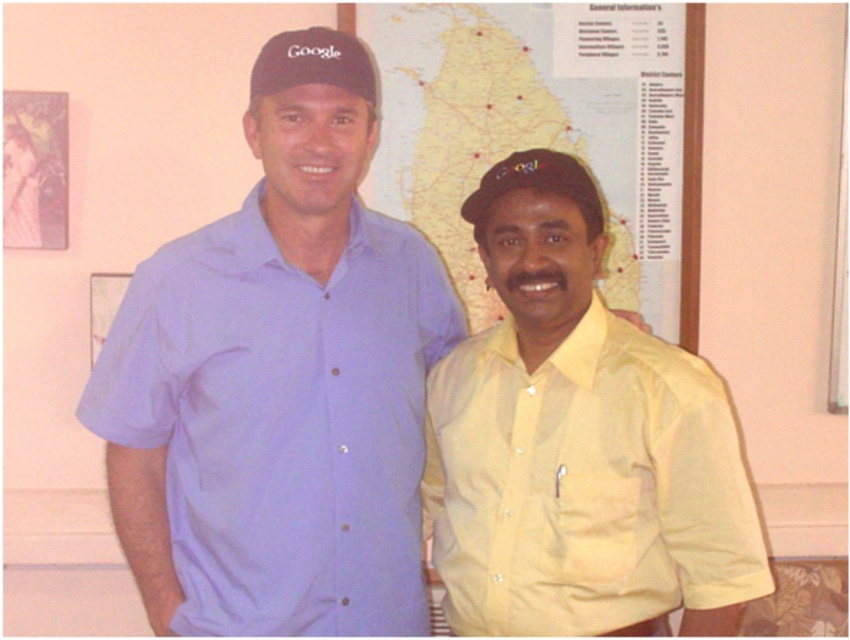
The image size is (850, 640). What are the coordinates of `yellow satin shirt at right` in the screenshot? It's located at (584, 484).

Is point (700, 538) positioned in front of point (313, 54)?

That is True.

The image size is (850, 640). In order to click on yellow satin shirt at right in this screenshot , I will do `click(584, 484)`.

Does point (275, 35) come in front of point (500, 161)?

Yes, it is in front of point (500, 161).

Is black matte baseball cap at upper center to the left of matte black cap at center from the viewer's perspective?

Yes, black matte baseball cap at upper center is to the left of matte black cap at center.

Find the location of a particular element. This screenshot has height=640, width=850. black matte baseball cap at upper center is located at coordinates (313, 64).

Identify the location of black matte baseball cap at upper center. (313, 64).

Describe the element at coordinates (282, 420) in the screenshot. I see `matte blue shirt at center` at that location.

Can you confirm if matte blue shirt at center is smaller than black matte baseball cap at upper center?

Actually, matte blue shirt at center might be larger than black matte baseball cap at upper center.

Between point (367, 278) and point (248, 88), which one is positioned in front?

Positioned in front is point (367, 278).

This screenshot has width=850, height=640. What are the coordinates of `matte blue shirt at center` in the screenshot? It's located at (282, 420).